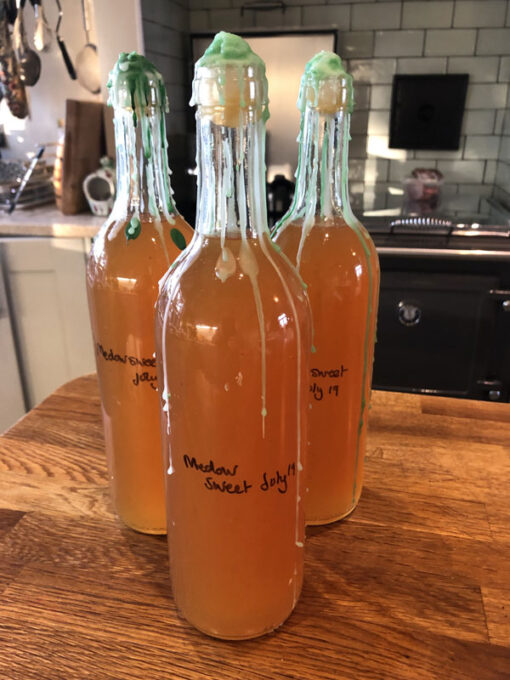
Locate an element on the screen. The image size is (510, 680). kitchen counter is located at coordinates (84, 221).